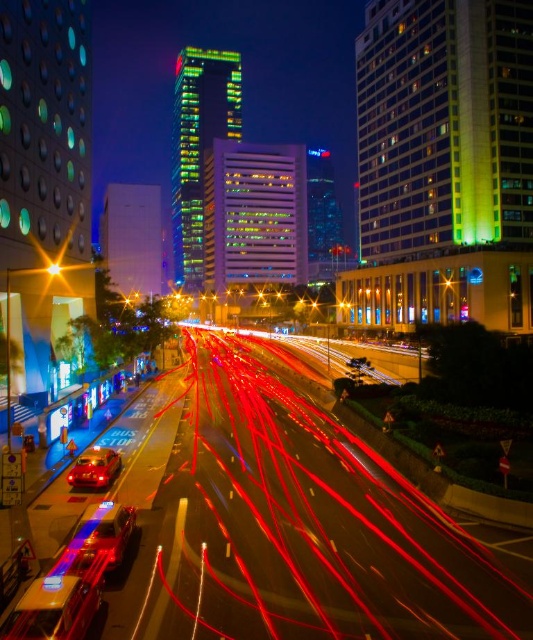
Does shiny red car at center have a smaller size compared to bright yellow light at center?

Actually, shiny red car at center might be larger than bright yellow light at center.

Describe the element at coordinates (94, 468) in the screenshot. I see `shiny red car at center` at that location.

Locate an element on the screen. shiny red car at center is located at coordinates (94, 468).

Based on the photo, between metallic silver car at center and bright yellow light at center, which one is positioned lower?

metallic silver car at center is lower down.

This screenshot has height=640, width=533. What are the coordinates of `metallic silver car at center` in the screenshot? It's located at (103, 532).

Between metallic silver car at center and shiny red car at center, which one appears on the left side from the viewer's perspective?

From the viewer's perspective, shiny red car at center appears more on the left side.

Does metallic silver car at center have a lesser height compared to shiny red car at center?

Yes, metallic silver car at center is shorter than shiny red car at center.

Between point (100, 506) and point (96, 474), which one is positioned in front?

Point (100, 506)

You are a GUI agent. You are given a task and a screenshot of the screen. Output one action in this format:
    pyautogui.click(x=<x>, y=<y>)
    Task: Click on the metallic silver car at center
    Image resolution: width=533 pixels, height=640 pixels.
    Given the screenshot: What is the action you would take?
    pyautogui.click(x=103, y=532)